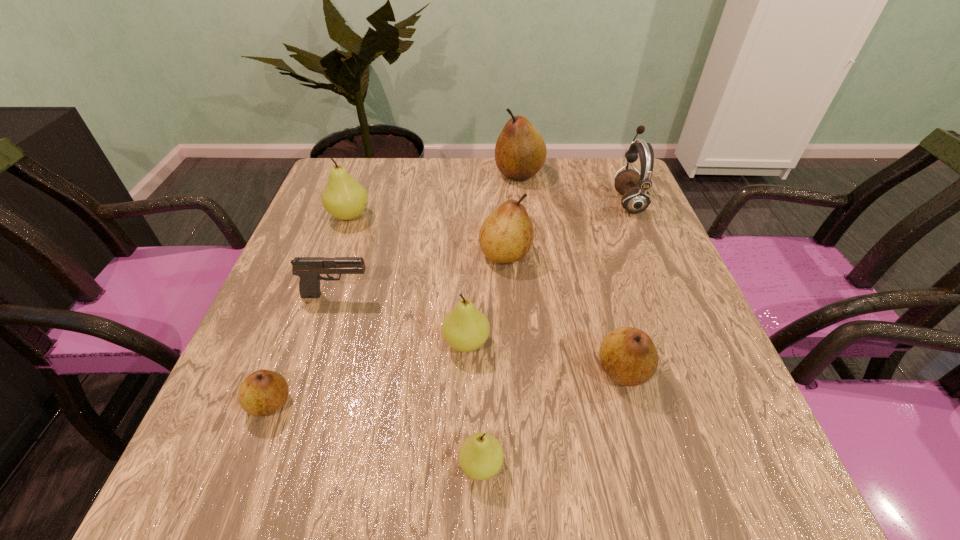
Image resolution: width=960 pixels, height=540 pixels. In order to click on the second smallest brown pear in this screenshot , I will do `click(628, 355)`.

At what (x,y) coordinates should I click in order to perform the action: click on the fifth farthest object. Please return your answer as a coordinate pair (x, y). The width and height of the screenshot is (960, 540). Looking at the image, I should click on (309, 269).

Find the location of a particular element. This screenshot has width=960, height=540. the leftmost brown pear is located at coordinates (263, 392).

Identify the location of the smallest green pear. (480, 457).

This screenshot has width=960, height=540. What are the coordinates of `the nearest object` in the screenshot? It's located at (480, 457).

You are a GUI agent. You are given a task and a screenshot of the screen. Output one action in this format:
    pyautogui.click(x=<x>, y=<y>)
    Task: Click on the free space located on the right of the biggest brown pear
    This screenshot has height=540, width=960.
    Given the screenshot: What is the action you would take?
    pyautogui.click(x=579, y=173)

Where is `vacant area located 0.380m on the ear pads of the brown earphone`? The height and width of the screenshot is (540, 960). vacant area located 0.380m on the ear pads of the brown earphone is located at coordinates (472, 201).

I want to click on vacant area situated on the ear pads of the brown earphone, so pyautogui.click(x=536, y=201).

The height and width of the screenshot is (540, 960). Find the location of `blank space located on the ear pads of the brown earphone`. blank space located on the ear pads of the brown earphone is located at coordinates (498, 201).

At what (x,y) coordinates should I click in order to perform the action: click on free spot located 0.300m on the front of the biggest green pear. Please return your answer as a coordinate pair (x, y). Looking at the image, I should click on (311, 322).